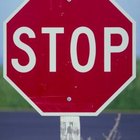
Identify the location of artwork. The width and height of the screenshot is (140, 140). (67, 56).